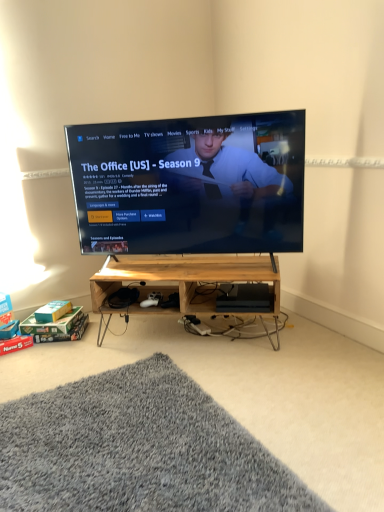
At what (x,y) coordinates should I click in order to perform the action: click on vacant area that is in front of wooden at center, the 1th shelf when ordered from bottom to top. Please return your answer as a coordinate pair (x, y). The image size is (384, 512). Looking at the image, I should click on (245, 381).